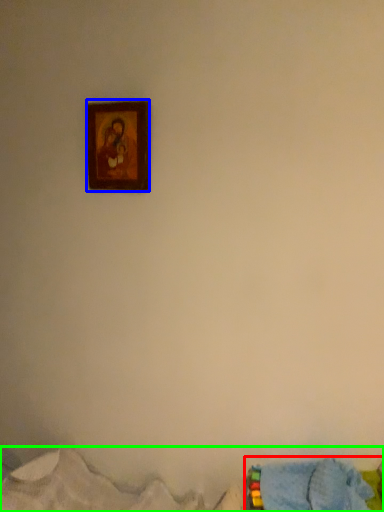
Question: Which object is positioned closest to bed (highlighted by a red box)? Select from picture frame (highlighted by a blue box) and bed (highlighted by a green box).

Choices:
 (A) picture frame
 (B) bed

Answer: (B)